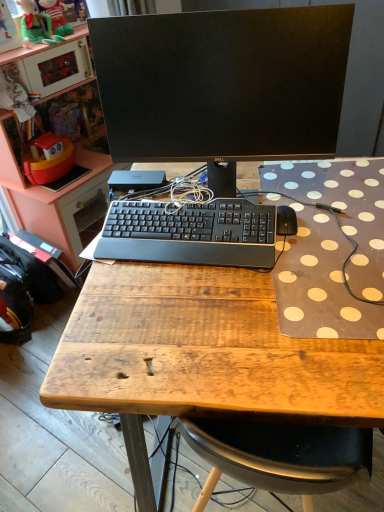
Where is `empty space that is to the right of black matte mouse at right`? This screenshot has width=384, height=512. empty space that is to the right of black matte mouse at right is located at coordinates (337, 214).